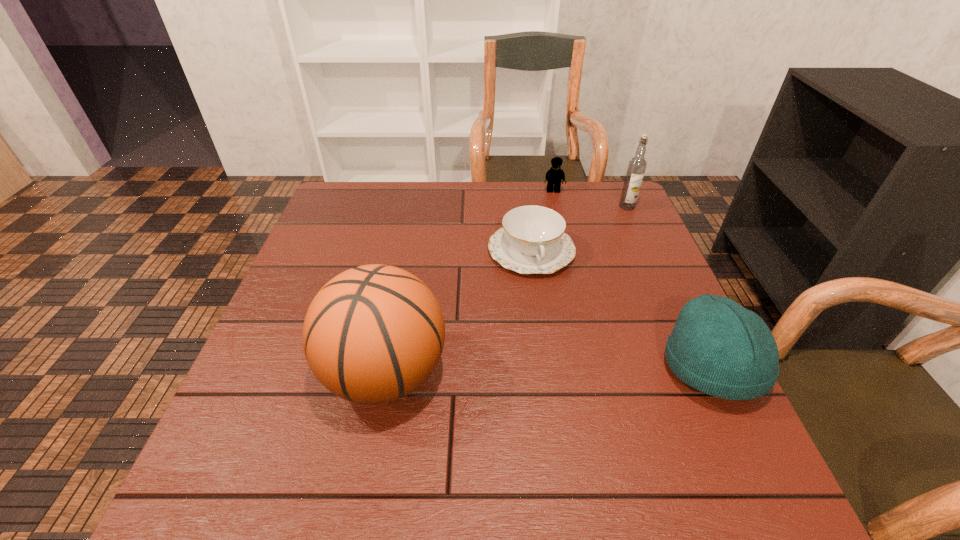
This screenshot has height=540, width=960. Identify the location of vacant space at the near edge. (575, 405).

You are a GUI agent. You are given a task and a screenshot of the screen. Output one action in this format:
    pyautogui.click(x=<x>, y=<y>)
    Task: Click on the vacant space at the left edge of the desktop
    
    Given the screenshot: What is the action you would take?
    pyautogui.click(x=346, y=261)

In the image, there is a desktop. Identify the location of vacant space at the right edge. The width and height of the screenshot is (960, 540). (618, 314).

The image size is (960, 540). In order to click on free space at the far left corner of the desktop in this screenshot , I will do (348, 189).

The width and height of the screenshot is (960, 540). Find the location of `free space that is in between the third tallest object and the chinaware`. free space that is in between the third tallest object and the chinaware is located at coordinates (621, 310).

Find the location of a particular element. vacant point located between the beanie and the Lego is located at coordinates click(632, 280).

Identify the location of free space that is in between the fourth nearest object and the third tallest object. The image size is (960, 540). (669, 287).

This screenshot has width=960, height=540. What are the coordinates of `free space between the second shortest object and the beanie` in the screenshot? It's located at (632, 280).

This screenshot has height=540, width=960. Identify the location of vacant space that's between the beanie and the chinaware. (621, 310).

At what (x,y) coordinates should I click in order to perform the action: click on free space that is in between the shortest object and the vodka. Please return your answer as a coordinate pair (x, y). Image resolution: width=960 pixels, height=540 pixels. Looking at the image, I should click on (579, 229).